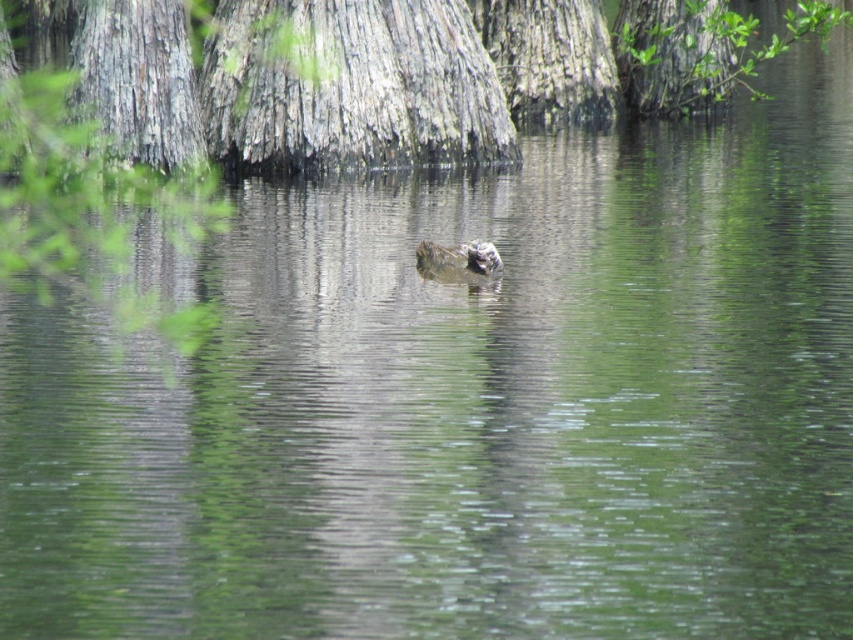
Is point (677, 113) more distant than point (708, 17)?

Yes, point (677, 113) is farther from viewer.

Can you confirm if gray textured bark at upper center is shorter than green leafy tree at upper right?

Incorrect, gray textured bark at upper center's height does not fall short of green leafy tree at upper right's.

Is point (364, 124) positioned in front of point (664, 28)?

That is True.

Identify the location of gray textured bark at upper center. (625, 54).

Measure the distance between green leafy tree at upper right and camera.

A distance of 26.54 meters exists between green leafy tree at upper right and camera.

In the scene shown: Which is more to the left, green leafy tree at upper right or brown fuzzy duck at center?

From the viewer's perspective, brown fuzzy duck at center appears more on the left side.

Is point (779, 45) farther from camera compared to point (419, 260)?

Yes, it is behind point (419, 260).

Locate an element on the screen. Image resolution: width=853 pixels, height=640 pixels. green leafy tree at upper right is located at coordinates (700, 49).

Can you confirm if gray textured bark at upper center is wider than brown fuzzy duck at center?

Correct, the width of gray textured bark at upper center exceeds that of brown fuzzy duck at center.

Can you confirm if gray textured bark at upper center is positioned to the right of brown fuzzy duck at center?

Yes, gray textured bark at upper center is to the right of brown fuzzy duck at center.

Where is `gray textured bark at upper center`? gray textured bark at upper center is located at coordinates (625, 54).